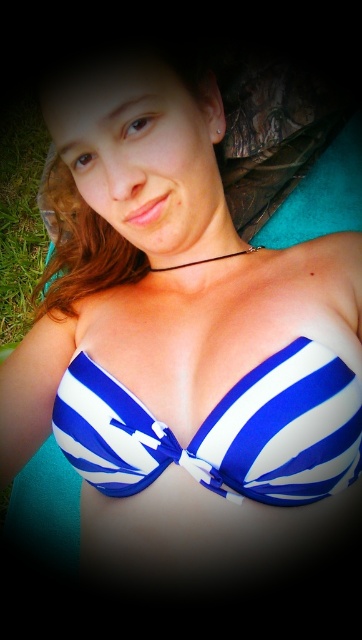
Is point (250, 387) positioned after point (32, 180)?

No, (250, 387) is closer to viewer.

Is point (295, 497) positioned in front of point (24, 136)?

Yes, it is.

Image resolution: width=362 pixels, height=640 pixels. I want to click on blue striped bikini top at center, so click(222, 429).